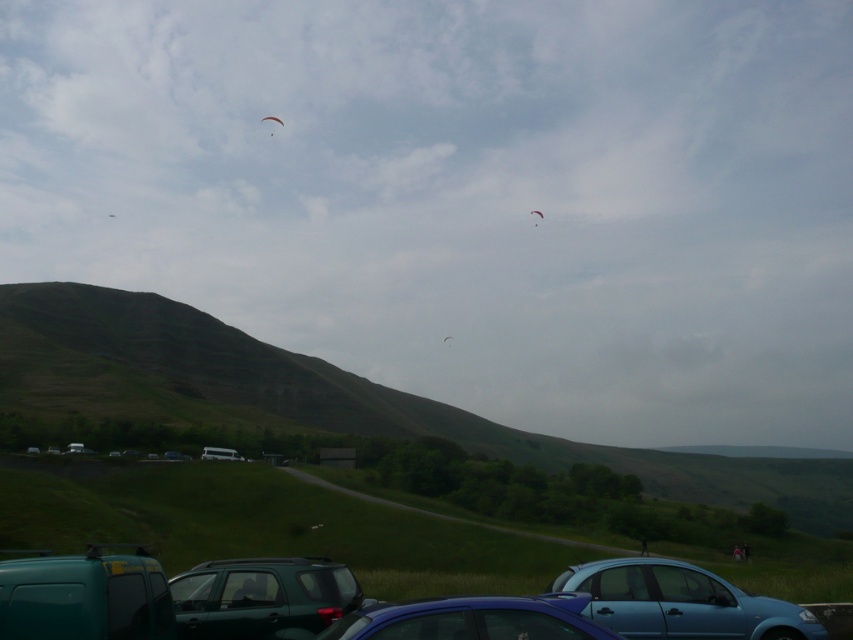
Question: Considering the relative positions of white matte van at lower center and white fabric kite at center in the image provided, where is white matte van at lower center located with respect to white fabric kite at center?

Choices:
 (A) below
 (B) above

Answer: (A)

Question: Which of these objects is positioned farthest from the white fabric kite at upper center?

Choices:
 (A) matte green suv at lower center
 (B) light blue fabric person at lower right
 (C) white fabric kite at center

Answer: (A)

Question: Among these points, which one is farthest from the camera?

Choices:
 (A) (538, 216)
 (B) (576, 582)
 (C) (200, 582)

Answer: (A)

Question: Observing the image, what is the correct spatial positioning of white matte van at lower center in reference to light blue jeans at lower right?

Choices:
 (A) left
 (B) right

Answer: (A)

Question: Which point appears closest to the camera in this image?

Choices:
 (A) (746, 545)
 (B) (531, 211)
 (C) (744, 637)

Answer: (C)

Question: Does metallic blue sedan at lower center have a greater width compared to metallic blue car at center?

Choices:
 (A) no
 (B) yes

Answer: (B)